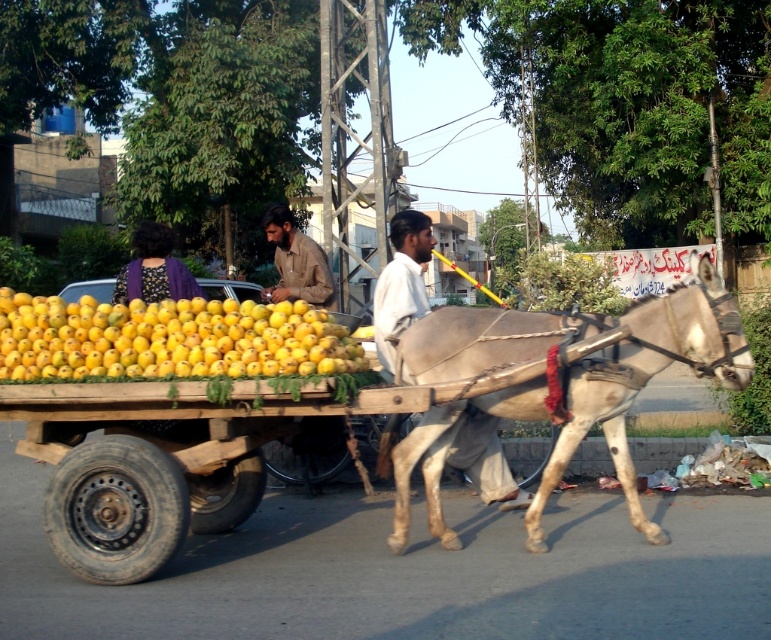
Question: Is white cotton shirt at center thinner than purple fabric at upper left?

Choices:
 (A) no
 (B) yes

Answer: (B)

Question: Is light brown leather harness at center wider than brown cotton shirt at center?

Choices:
 (A) no
 (B) yes

Answer: (B)

Question: Among these objects, which one is farthest from the camera?

Choices:
 (A) yellow matte mangoes at center
 (B) brown cotton shirt at center

Answer: (B)

Question: Can you confirm if yellow matte mangoes at center is positioned to the left of white cotton shirt at center?

Choices:
 (A) yes
 (B) no

Answer: (A)

Question: Which of the following is the closest to the observer?

Choices:
 (A) (136, 250)
 (B) (456, 448)

Answer: (B)

Question: Which object appears farthest from the camera in this image?

Choices:
 (A) white cotton shirt at center
 (B) brown cotton shirt at center
 (C) purple fabric at upper left

Answer: (B)